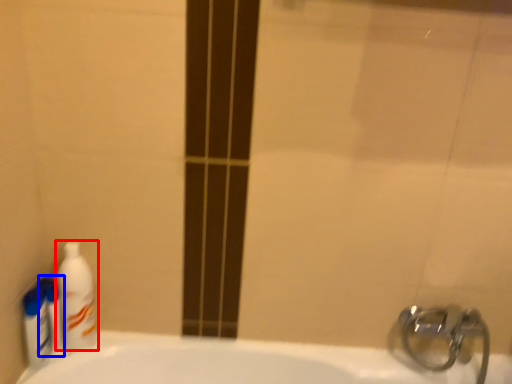
Question: Which object appears closest to the camera in this image, cleaning product (highlighted by a red box) or mouthwash (highlighted by a blue box)?

Choices:
 (A) cleaning product
 (B) mouthwash

Answer: (A)